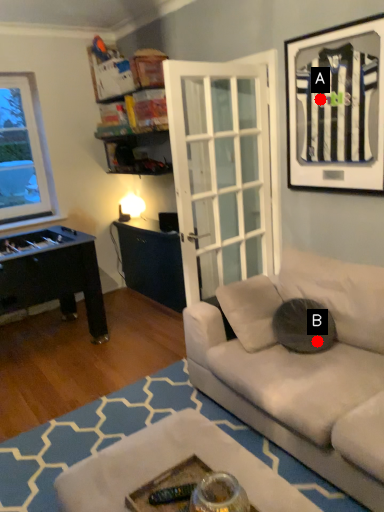
Question: Two points are circled on the image, labeled by A and B beside each circle. Which point appears farthest from the camera in this image?

Choices:
 (A) A is further
 (B) B is further

Answer: (A)